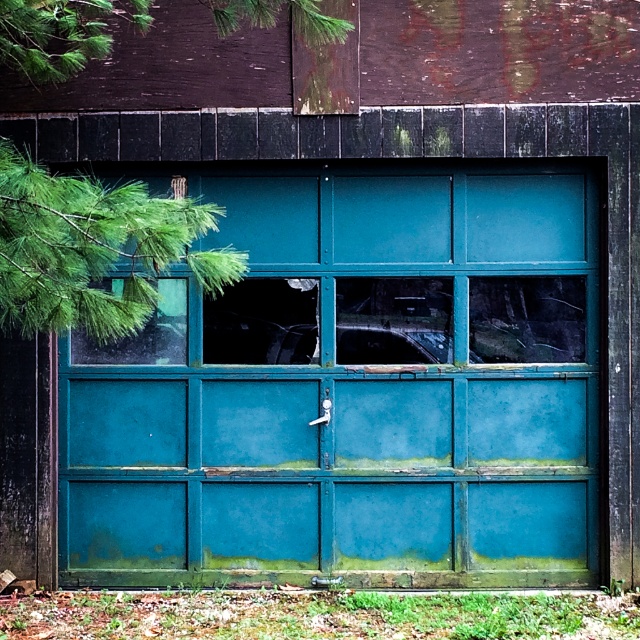
Question: Estimate the real-world distances between objects in this image. Which object is closer to the green leafy branch at left?

Choices:
 (A) teal painted wood garage door at center
 (B) teal glass window at upper left
 (C) teal matte window at center

Answer: (B)

Question: Which point is farther to the camera?

Choices:
 (A) green leafy branch at left
 (B) green leafy branch at upper left

Answer: (B)

Question: Is green leafy branch at upper left closer to camera compared to teal matte window at center?

Choices:
 (A) yes
 (B) no

Answer: (A)

Question: Can you confirm if teal painted wood garage door at center is wider than teal matte window at center?

Choices:
 (A) no
 (B) yes

Answer: (B)

Question: Which of the following is the farthest from the observer?

Choices:
 (A) green leafy branch at upper left
 (B) teal matte window at center
 (C) teal painted wood garage door at center
 (D) teal glass window at upper left

Answer: (B)

Question: Does teal painted wood garage door at center appear under green leafy branch at upper left?

Choices:
 (A) no
 (B) yes

Answer: (B)